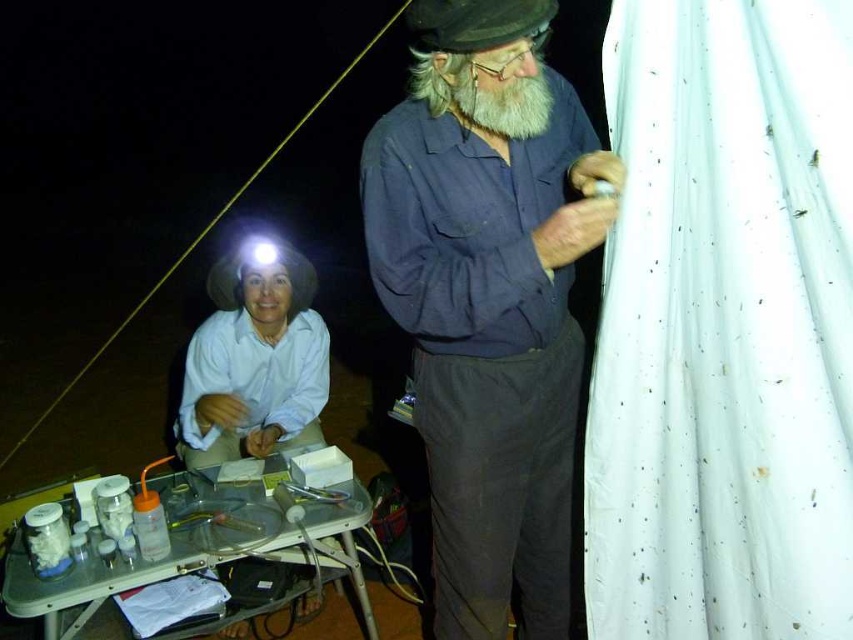
Based on the scene description, can you determine which object is bigger between the blue cotton shirt at center and the white matte hat at upper left?

The blue cotton shirt at center has a larger size compared to the white matte hat at upper left.

Based on the scene description, which object is taller between the blue cotton shirt at center and the white matte hat at upper left?

The blue cotton shirt at center is taller than the white matte hat at upper left according to the description.